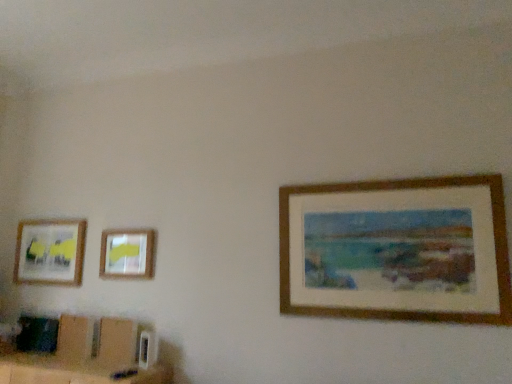
Question: In terms of size, does matte plastic picture frame at upper left, placed as the second picture frame when sorted from back to front, appear bigger or smaller than matte wooden picture frame at left, the first picture frame positioned from the back?

Choices:
 (A) big
 (B) small

Answer: (B)

Question: From a real-world perspective, is matte plastic picture frame at upper left, placed as the second picture frame when sorted from back to front, positioned above or below matte wooden picture frame at left, which is the third picture frame from front to back?

Choices:
 (A) below
 (B) above

Answer: (A)

Question: Which object is the farthest from the matte plastic picture frame at upper left, placed as the second picture frame when sorted from back to front?

Choices:
 (A) wooden picture frame at right, positioned as the first picture frame in front-to-back order
 (B) matte wooden picture frame at left, which is the third picture frame from front to back

Answer: (A)

Question: Which object is positioned closest to the wooden picture frame at right, positioned as the first picture frame in front-to-back order?

Choices:
 (A) matte plastic picture frame at upper left, placed as the second picture frame when sorted from back to front
 (B) matte wooden picture frame at left, the 1th picture frame when ordered from left to right

Answer: (A)